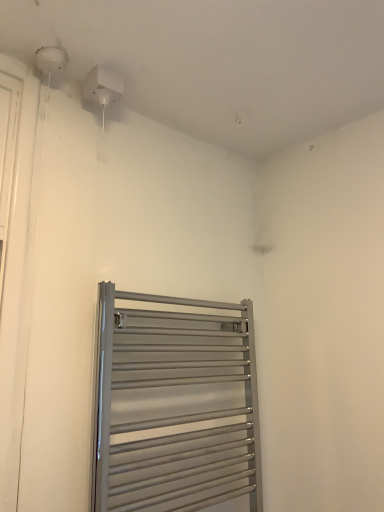
Describe the element at coordinates (174, 405) in the screenshot. Image resolution: width=384 pixels, height=512 pixels. I see `satin silver towel rack at lower center` at that location.

This screenshot has width=384, height=512. What are the coordinates of `satin silver towel rack at lower center` in the screenshot? It's located at (174, 405).

The height and width of the screenshot is (512, 384). I want to click on satin silver towel rack at lower center, so click(174, 405).